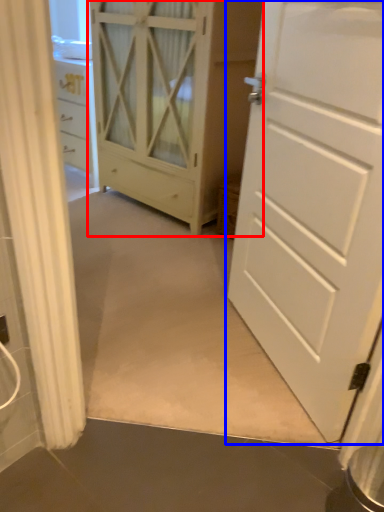
Question: Among these objects, which one is nearest to the camera, cupboard (highlighted by a red box) or door (highlighted by a blue box)?

Choices:
 (A) cupboard
 (B) door

Answer: (B)